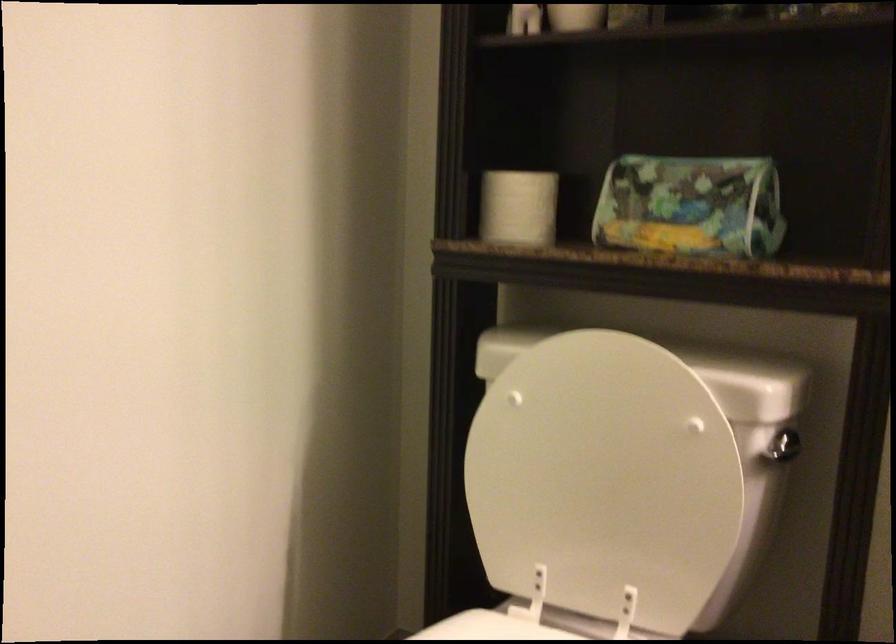
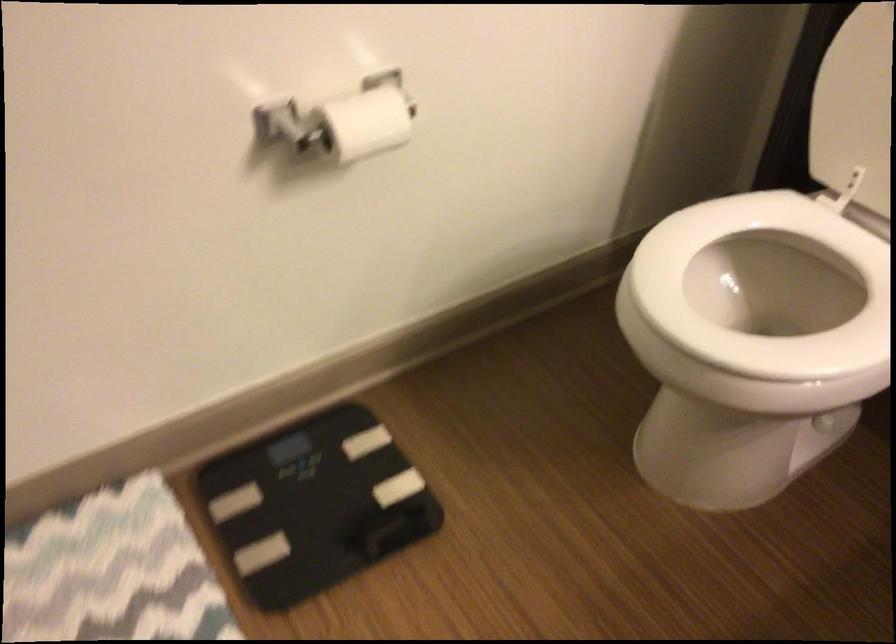
The images are taken continuously from a first-person perspective. In which direction is your viewpoint rotating?

The camera rotated toward left-down.